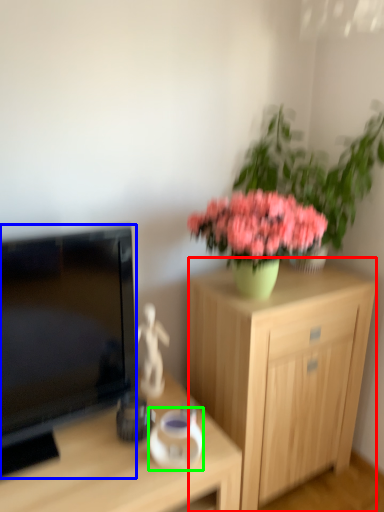
Question: Considering the real-world distances, which object is closest to cabinetry (highlighted by a red box)? television (highlighted by a blue box) or vase (highlighted by a green box).

Choices:
 (A) television
 (B) vase

Answer: (B)